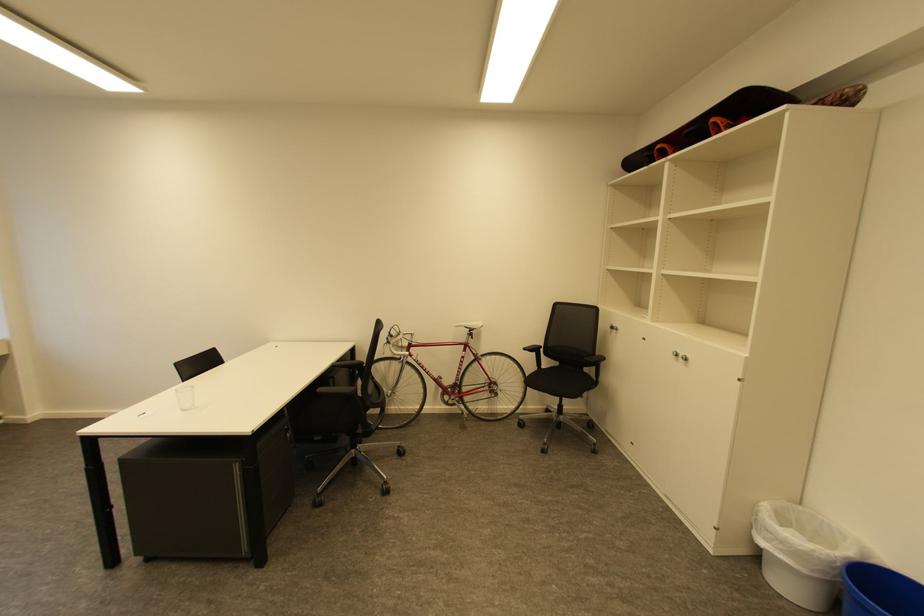
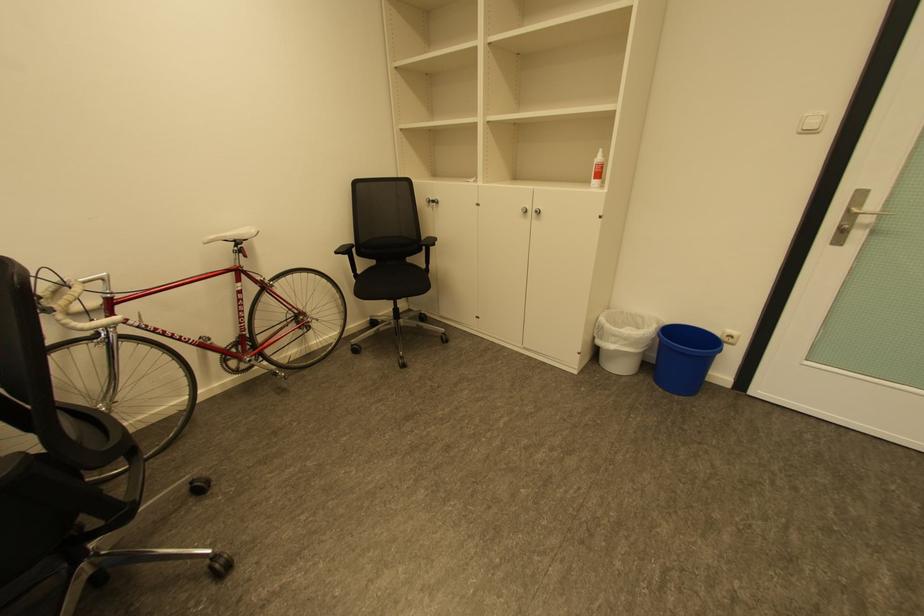
Locate, in the second image, the point that corresponds to (x=775, y=533) in the first image.

(622, 337)